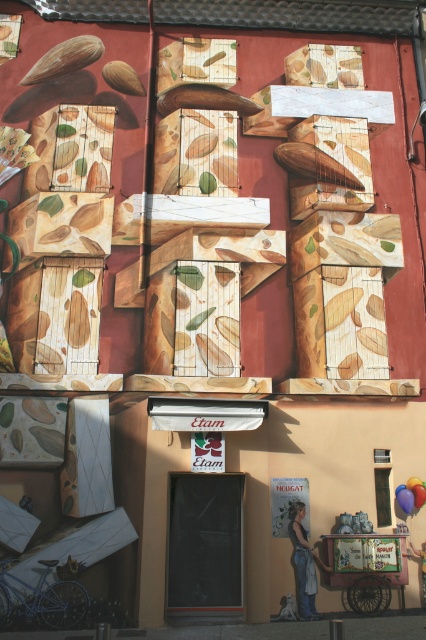
You are a painter who wants to add a new cookie to the mural. You have two options for placement near the existing cookies. The options are the matte brown mushroom at upper left and the brown wood nut at upper left. Which of these two has a taller height, so you can ensure the new cookie doesn

The matte brown mushroom at upper left has a greater height compared to the brown wood nut at upper left, so placing the new cookie there would accommodate the taller structure.

You are an architect designing a new building and want to place a decorative element at coordinate point 0.092, 0.153. Would the existing matte brown mushroom at upper left interfere with your design?

The matte brown mushroom at upper left is already positioned at coordinate point (65, 58), so placing a decorative element there would interfere with it.

You are standing in front of the building with the biscuit mural. You notice two items on the upper left corner of the mural. One is a matte brown mushroom at upper left and the other is a brown wood nut at upper left. Which one is positioned more to the left side?

The matte brown mushroom at upper left is positioned more to the left than the brown wood nut at upper left.